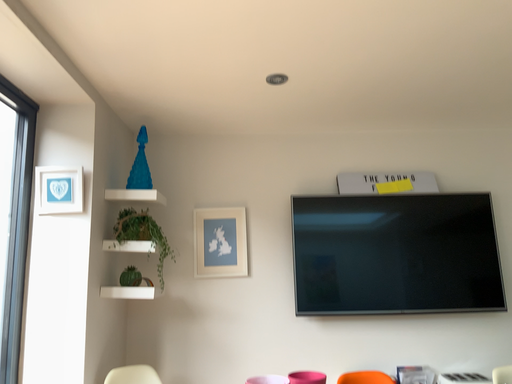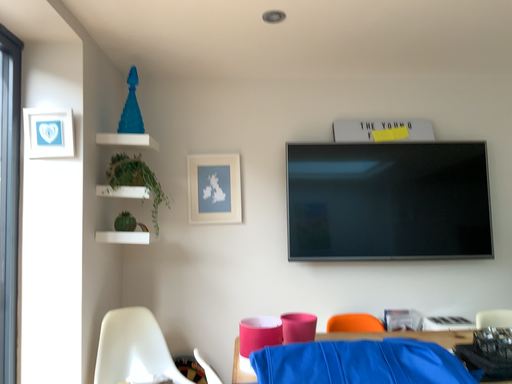
Question: Which way did the camera rotate in the video?

Choices:
 (A) rotated upward
 (B) rotated downward

Answer: (B)